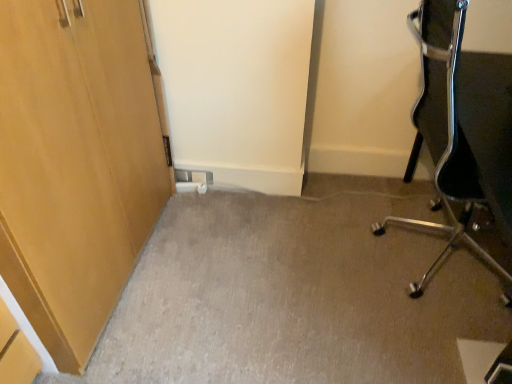
Question: Should I look upward or downward to see black mesh chair at right?

Choices:
 (A) down
 (B) up

Answer: (A)